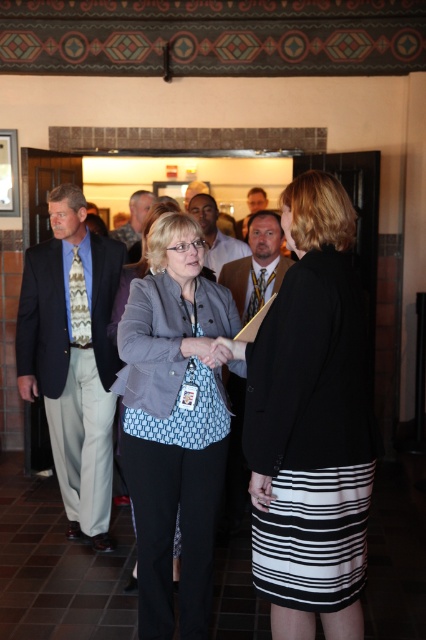
Who is lower down, black textured blazer at center or matte gray blazer at center?

matte gray blazer at center is lower down.

Is point (330, 257) closer to camera compared to point (273, 282)?

Yes, point (330, 257) is in front of point (273, 282).

Identify the location of black textured blazer at center. (311, 424).

Based on the photo, does matte gray suit at center appear on the right side of light brown leather jacket at center?

Correct, you'll find matte gray suit at center to the right of light brown leather jacket at center.

Which is more to the left, matte gray suit at center or light brown leather jacket at center?

Positioned to the left is light brown leather jacket at center.

This screenshot has width=426, height=640. Find the location of `matte gray suit at center`. matte gray suit at center is located at coordinates (215, 234).

Does black textured blazer at center have a larger size compared to light brown wood chair at center?

Actually, black textured blazer at center might be smaller than light brown wood chair at center.

Between black textured blazer at center and light brown wood chair at center, which one is positioned higher?

light brown wood chair at center is higher up.

Is point (362, 372) farther from viewer compared to point (265, 204)?

That is False.

The image size is (426, 640). What are the coordinates of `black textured blazer at center` in the screenshot? It's located at (311, 424).